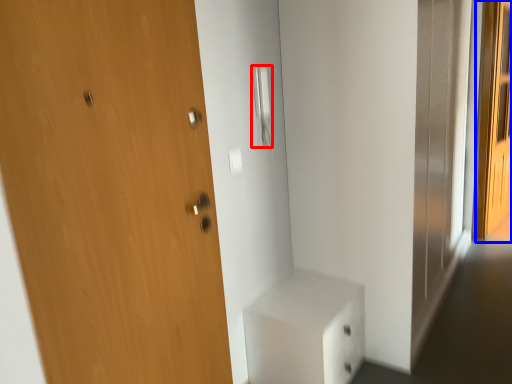
Question: Which of the following is the farthest to the observer, door handle (highlighted by a red box) or screen door (highlighted by a blue box)?

Choices:
 (A) door handle
 (B) screen door

Answer: (B)